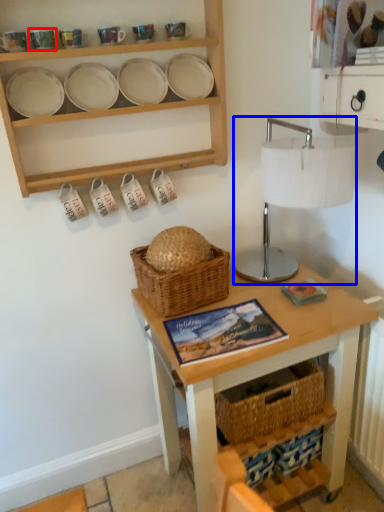
Question: Among these objects, which one is nearest to the camera, tableware (highlighted by a red box) or table lamp (highlighted by a blue box)?

Choices:
 (A) tableware
 (B) table lamp

Answer: (B)